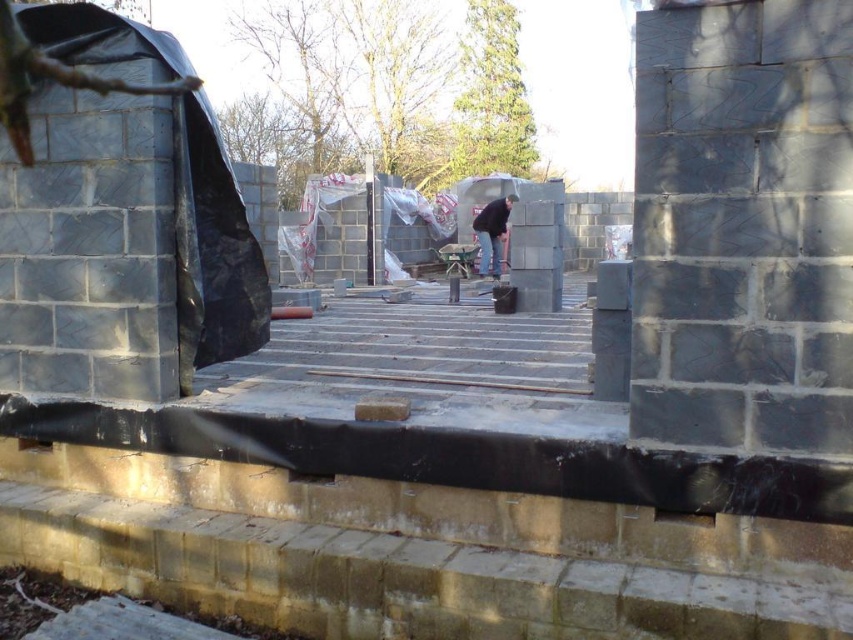
You are a construction inspector who needs to walk from the smooth concrete stairs at center to the dark gray concrete construction worker at center. How far will you have to walk?

The smooth concrete stairs at center and dark gray concrete construction worker at center are 9.12 meters apart, so you will have to walk 9.12 meters.

You are standing at the entrance of the construction site and need to locate the smooth concrete stairs at center. According to the coordinates provided, where exactly are they positioned in the image?

The smooth concrete stairs at center are located at the coordinates point (421, 348).